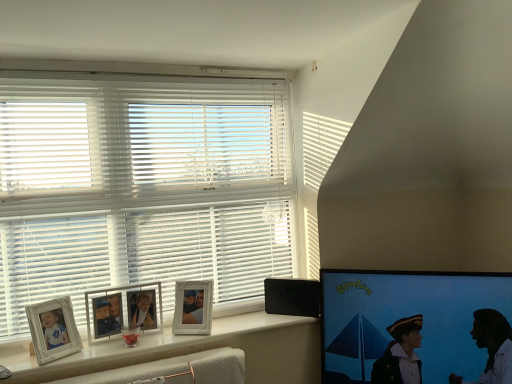
What do you see at coordinates (193, 308) in the screenshot? I see `white glossy picture frame at upper center, which ranks as the 2th picture frame in left-to-right order` at bounding box center [193, 308].

I want to click on matte black screen at right, so (x=406, y=317).

This screenshot has width=512, height=384. Describe the element at coordinates (292, 297) in the screenshot. I see `black plastic speaker at lower right` at that location.

What do you see at coordinates (193, 351) in the screenshot? This screenshot has width=512, height=384. I see `white glossy window sill at lower left` at bounding box center [193, 351].

Find the location of a particular element. The height and width of the screenshot is (384, 512). white glossy picture frame at upper center, which appears as the first picture frame when viewed from the right is located at coordinates (193, 308).

Is white wooden picture frame at lower left, the 1th picture frame viewed from the left, placed right next to matte black screen at right?

No, white wooden picture frame at lower left, the 1th picture frame viewed from the left, is not with matte black screen at right.

Based on the photo, measure the distance between white wooden picture frame at lower left, acting as the second picture frame starting from the right, and matte black screen at right.

The distance of white wooden picture frame at lower left, acting as the second picture frame starting from the right, from matte black screen at right is 37.07 inches.

I want to click on computer monitor located on the right of white wooden picture frame at lower left, the 1th picture frame viewed from the left, so click(406, 317).

Does point (117, 292) come farther from viewer compared to point (424, 371)?

Yes, point (117, 292) is behind point (424, 371).

Who is smaller, matte black screen at right or white glossy window sill at lower left?

Smaller between the two is white glossy window sill at lower left.

From the image's perspective, which one is positioned higher, matte black screen at right or white glossy window sill at lower left?

From the image's view, matte black screen at right is above.

How different are the orientations of matte black screen at right and white glossy window sill at lower left in degrees?

41.7 degrees separate the facing orientations of matte black screen at right and white glossy window sill at lower left.

From a real-world perspective, between matte black screen at right and white glossy window sill at lower left, who is vertically lower?

matte black screen at right.

Does white matte blinds at upper left turn towards black plastic speaker at lower right?

Yes, white matte blinds at upper left faces towards black plastic speaker at lower right.

Can you confirm if white matte blinds at upper left is smaller than black plastic speaker at lower right?

No, white matte blinds at upper left is not smaller than black plastic speaker at lower right.

From a real-world perspective, who is located higher, white matte blinds at upper left or black plastic speaker at lower right?

white matte blinds at upper left, from a real-world perspective.

Which object is further away from the camera taking this photo, white matte blinds at upper left or black plastic speaker at lower right?

black plastic speaker at lower right.

Is matte black screen at right shorter than white wooden picture frame at lower left, the 1th picture frame viewed from the left?

No, matte black screen at right is not shorter than white wooden picture frame at lower left, the 1th picture frame viewed from the left.

Is point (360, 366) less distant than point (98, 320)?

No.

Is there a large distance between matte black screen at right and white wooden picture frame at lower left, acting as the second picture frame starting from the right?

No, matte black screen at right is not far away from white wooden picture frame at lower left, acting as the second picture frame starting from the right.

Based on the photo, is matte black screen at right further to the viewer compared to white wooden picture frame at lower left, acting as the second picture frame starting from the right?

No, matte black screen at right is closer to the viewer.

Is black plastic speaker at lower right oriented away from matte black screen at right?

That's not correct — black plastic speaker at lower right is not looking away from matte black screen at right.

From the image's perspective, between black plastic speaker at lower right and matte black screen at right, who is located below?

matte black screen at right appears lower in the image.

From the picture: How different are the orientations of black plastic speaker at lower right and matte black screen at right in degrees?

black plastic speaker at lower right and matte black screen at right are facing 1.66 degrees away from each other.

Considering the sizes of black plastic speaker at lower right and white matte blinds at upper left in the image, is black plastic speaker at lower right bigger or smaller than white matte blinds at upper left?

Considering their sizes, black plastic speaker at lower right takes up less space than white matte blinds at upper left.

Which object is positioned more to the right, black plastic speaker at lower right or white matte blinds at upper left?

From the viewer's perspective, black plastic speaker at lower right appears more on the right side.

Could you tell me if black plastic speaker at lower right is turned towards white matte blinds at upper left?

No.

From a real-world perspective, is white wooden picture frame at lower left, acting as the second picture frame starting from the right, physically located above or below white glossy window sill at lower left?

white wooden picture frame at lower left, acting as the second picture frame starting from the right, is above white glossy window sill at lower left.

Does point (135, 320) appear closer or farther from the camera than point (170, 351)?

Point (135, 320).

Is white wooden picture frame at lower left, acting as the second picture frame starting from the right, oriented away from white glossy window sill at lower left?

No, white glossy window sill at lower left is not at the back of white wooden picture frame at lower left, acting as the second picture frame starting from the right.

Is white wooden picture frame at lower left, acting as the second picture frame starting from the right, positioned before white glossy window sill at lower left?

No, it is not.

Where is `computer monitor lying in front of the white wooden picture frame at lower left, acting as the second picture frame starting from the right`? The width and height of the screenshot is (512, 384). computer monitor lying in front of the white wooden picture frame at lower left, acting as the second picture frame starting from the right is located at coordinates click(x=406, y=317).

Locate an element on the screen. The width and height of the screenshot is (512, 384). window sill above the matte black screen at right (from a real-world perspective) is located at coordinates (193, 351).

When comparing their distances from matte black screen at right, does white wooden picture frame at lower left, the 1th picture frame viewed from the left, or white glossy window sill at lower left seem closer?

Based on the image, white glossy window sill at lower left appears to be nearer to matte black screen at right.

Considering their positions, is white glossy picture frame at upper center, which appears as the first picture frame when viewed from the right, positioned closer to black plastic speaker at lower right than white matte blinds at upper left?

Among the two, white glossy picture frame at upper center, which appears as the first picture frame when viewed from the right, is located nearer to black plastic speaker at lower right.

When comparing their distances from matte black screen at right, does white matte blinds at upper left or black plastic speaker at lower right seem closer?

black plastic speaker at lower right is positioned closer to the anchor matte black screen at right.

When comparing their distances from black plastic speaker at lower right, does white glossy window sill at lower left or white glossy picture frame at upper center, which ranks as the 2th picture frame in left-to-right order, seem further?

white glossy picture frame at upper center, which ranks as the 2th picture frame in left-to-right order, is positioned further to the anchor black plastic speaker at lower right.

Which object lies further to the anchor point matte black screen at right, white wooden picture frame at lower left, the 1th picture frame viewed from the left, or black plastic speaker at lower right?

white wooden picture frame at lower left, the 1th picture frame viewed from the left, is positioned further to the anchor matte black screen at right.

Which object lies nearer to the anchor point white glossy picture frame at upper center, which ranks as the 2th picture frame in left-to-right order, black plastic speaker at lower right or white matte blinds at upper left?

The object closer to white glossy picture frame at upper center, which ranks as the 2th picture frame in left-to-right order, is black plastic speaker at lower right.

When comparing their distances from white matte blinds at upper left, does white glossy picture frame at upper center, which ranks as the 2th picture frame in left-to-right order, or white wooden picture frame at lower left, the 1th picture frame viewed from the left, seem closer?

Based on the image, white wooden picture frame at lower left, the 1th picture frame viewed from the left, appears to be nearer to white matte blinds at upper left.

From the image, which object appears to be farther from white glossy window sill at lower left, black plastic speaker at lower right or white glossy picture frame at upper center, which appears as the first picture frame when viewed from the right?

Based on the image, black plastic speaker at lower right appears to be further to white glossy window sill at lower left.

Where is `window sill between white wooden picture frame at lower left, the 1th picture frame viewed from the left, and matte black screen at right, in the horizontal direction`? This screenshot has width=512, height=384. window sill between white wooden picture frame at lower left, the 1th picture frame viewed from the left, and matte black screen at right, in the horizontal direction is located at coordinates (193, 351).

The height and width of the screenshot is (384, 512). Identify the location of speaker situated between white matte blinds at upper left and matte black screen at right from left to right. (292, 297).

Find the location of a particular element. picture frame situated between white wooden picture frame at lower left, the 1th picture frame viewed from the left, and black plastic speaker at lower right from left to right is located at coordinates (193, 308).

I want to click on window sill situated between white wooden picture frame at lower left, the 1th picture frame viewed from the left, and black plastic speaker at lower right from left to right, so click(193, 351).